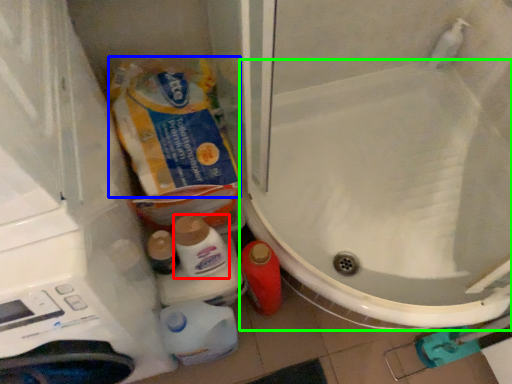
Question: Which object is the farthest from cleaning product (highlighted by a red box)? Choose among these: product (highlighted by a blue box) or toilet (highlighted by a green box).

Choices:
 (A) product
 (B) toilet

Answer: (B)